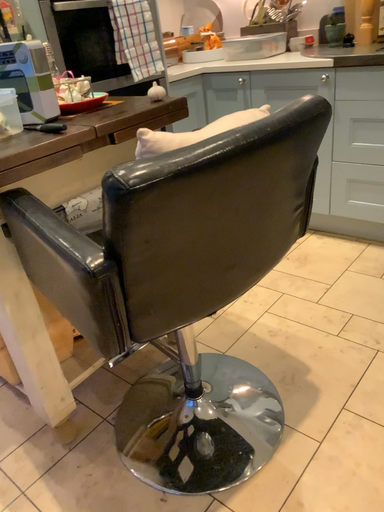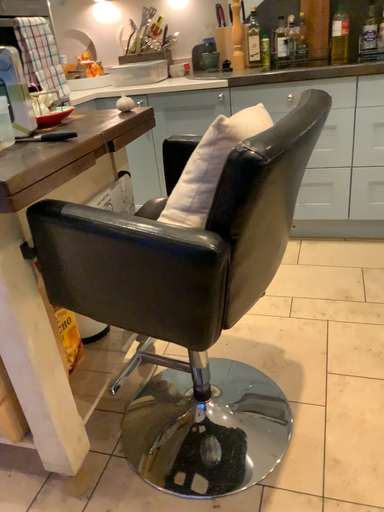
Question: How did the camera likely rotate when shooting the video?

Choices:
 (A) rotated right
 (B) rotated left

Answer: (A)